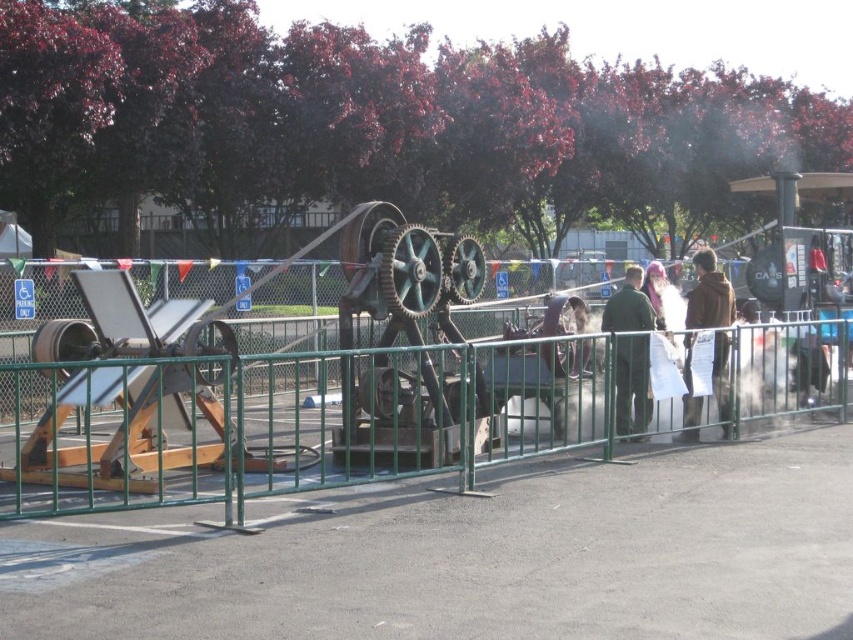
Between brown fuzzy coat at right and green matte jacket at center, which one appears on the left side from the viewer's perspective?

From the viewer's perspective, green matte jacket at center appears more on the left side.

Who is more forward, (697, 422) or (647, 364)?

Point (647, 364) is more forward.

Locate an element on the screen. This screenshot has height=640, width=853. brown fuzzy coat at right is located at coordinates tap(709, 294).